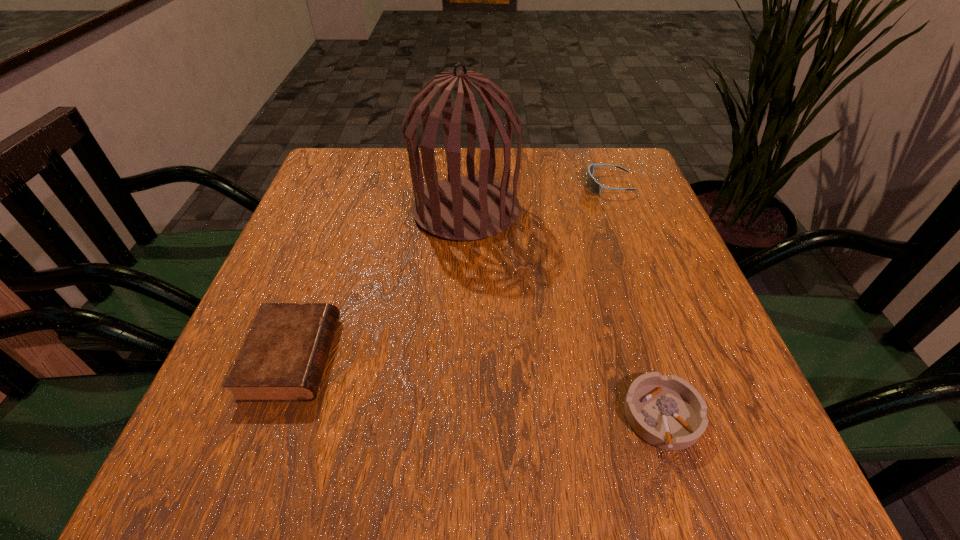
The width and height of the screenshot is (960, 540). What are the coordinates of `the third object from right to left` in the screenshot? It's located at (464, 208).

Where is `the tallest object`? the tallest object is located at coordinates (464, 208).

Find the location of a particular element. diary is located at coordinates (283, 357).

The height and width of the screenshot is (540, 960). In order to click on goggles in this screenshot , I will do (594, 186).

Identify the location of ashtray. This screenshot has width=960, height=540. (667, 412).

You are a GUI agent. You are given a task and a screenshot of the screen. Output one action in this format:
    pyautogui.click(x=<x>, y=<y>)
    Task: Click on the vacant space situated 0.080m on the back of the tallest object
    The image size is (960, 540).
    Given the screenshot: What is the action you would take?
    [x=468, y=164]

Image resolution: width=960 pixels, height=540 pixels. Find the location of `free space located on the spine side of the diary`. free space located on the spine side of the diary is located at coordinates [554, 357].

I want to click on free location located on the front-facing side of the goggles, so click(452, 185).

The height and width of the screenshot is (540, 960). I want to click on vacant space located on the front-facing side of the goggles, so click(428, 185).

Where is `free space located 0.150m on the front-facing side of the goggles`? This screenshot has width=960, height=540. free space located 0.150m on the front-facing side of the goggles is located at coordinates (525, 185).